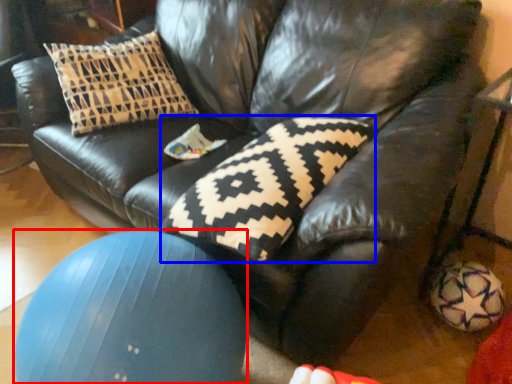
Question: Which object appears farthest to the camera in this image, ball (highlighted by a red box) or pillow (highlighted by a blue box)?

Choices:
 (A) ball
 (B) pillow

Answer: (B)